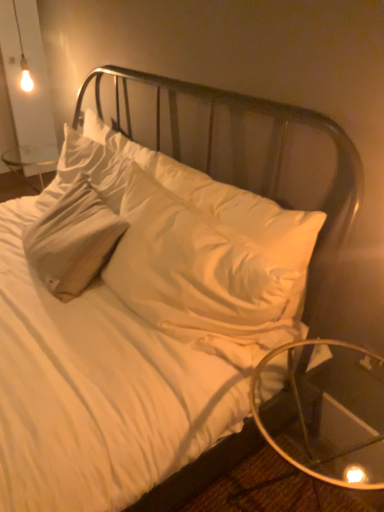
Question: Is transparent glass table at lower right closer to the viewer compared to white soft pillow at center?

Choices:
 (A) yes
 (B) no

Answer: (A)

Question: Is transparent glass table at lower right located outside white soft pillow at center?

Choices:
 (A) no
 (B) yes

Answer: (B)

Question: From a real-world perspective, is transparent glass table at lower right positioned under white soft pillow at center based on gravity?

Choices:
 (A) yes
 (B) no

Answer: (A)

Question: Is transparent glass table at lower right at the left side of white soft pillow at center?

Choices:
 (A) yes
 (B) no

Answer: (B)

Question: Is transparent glass table at lower right thinner than white soft pillow at center?

Choices:
 (A) no
 (B) yes

Answer: (A)

Question: Is transparent glass table at lower right at the right side of white soft pillow at center?

Choices:
 (A) no
 (B) yes

Answer: (B)

Question: Considering the relative sizes of white soft pillow at center and transparent glass table at lower right in the image provided, is white soft pillow at center smaller than transparent glass table at lower right?

Choices:
 (A) yes
 (B) no

Answer: (B)

Question: Could transparent glass table at lower right be considered to be inside white soft pillow at center?

Choices:
 (A) yes
 (B) no

Answer: (B)

Question: Considering the relative sizes of white soft pillow at center and transparent glass table at lower right in the image provided, is white soft pillow at center shorter than transparent glass table at lower right?

Choices:
 (A) yes
 (B) no

Answer: (B)

Question: From a real-world perspective, is white soft pillow at center on transparent glass table at lower right?

Choices:
 (A) yes
 (B) no

Answer: (A)

Question: From the image's perspective, is white soft pillow at center above transparent glass table at lower right?

Choices:
 (A) yes
 (B) no

Answer: (A)

Question: Considering the relative positions of white soft pillow at center and transparent glass table at lower right in the image provided, is white soft pillow at center to the right of transparent glass table at lower right from the viewer's perspective?

Choices:
 (A) no
 (B) yes

Answer: (A)

Question: Relative to white soft pillow at center, is transparent glass table at lower right in front or behind?

Choices:
 (A) behind
 (B) front

Answer: (B)